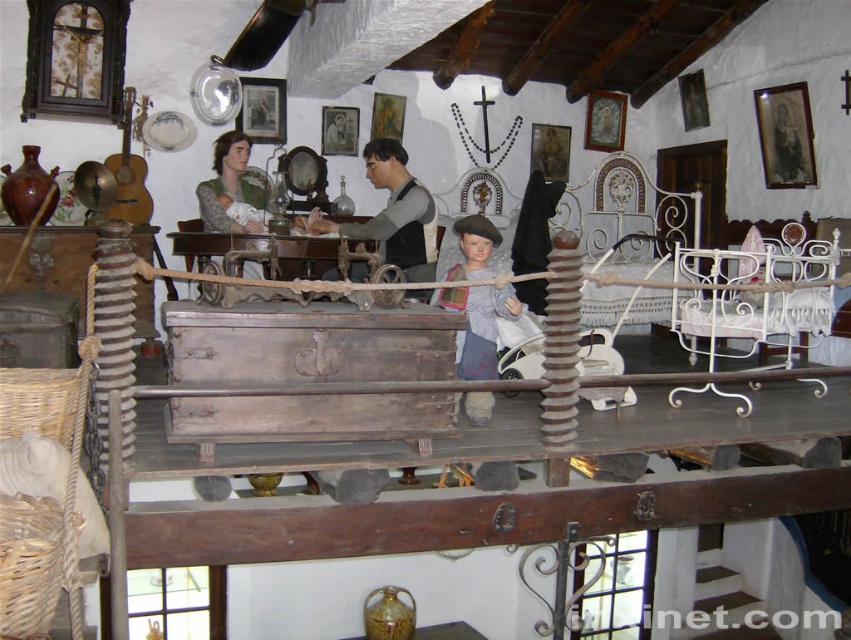
Between smooth gray shirt at center and matte green fabric doll at center, which one has less height?

matte green fabric doll at center is shorter.

Between point (397, 211) and point (261, 225), which one is positioned in front?

Point (397, 211) is more forward.

You are a GUI agent. You are given a task and a screenshot of the screen. Output one action in this format:
    pyautogui.click(x=<x>, y=<y>)
    Task: Click on the smooth gray shirt at center
    Image resolution: width=851 pixels, height=640 pixels.
    Given the screenshot: What is the action you would take?
    pyautogui.click(x=392, y=212)

Identify the location of wooden chest at center. The width and height of the screenshot is (851, 640). (437, 520).

Where is `wooden chest at center`? wooden chest at center is located at coordinates (437, 520).

Locate an element on the screen. The image size is (851, 640). wooden chest at center is located at coordinates (437, 520).

Is point (415, 493) positioned before point (375, 186)?

Yes, point (415, 493) is in front of point (375, 186).

Does wooden chest at center appear over smooth gray shirt at center?

No.

What do you see at coordinates (437, 520) in the screenshot? The height and width of the screenshot is (640, 851). I see `wooden chest at center` at bounding box center [437, 520].

I want to click on wooden chest at center, so click(x=437, y=520).